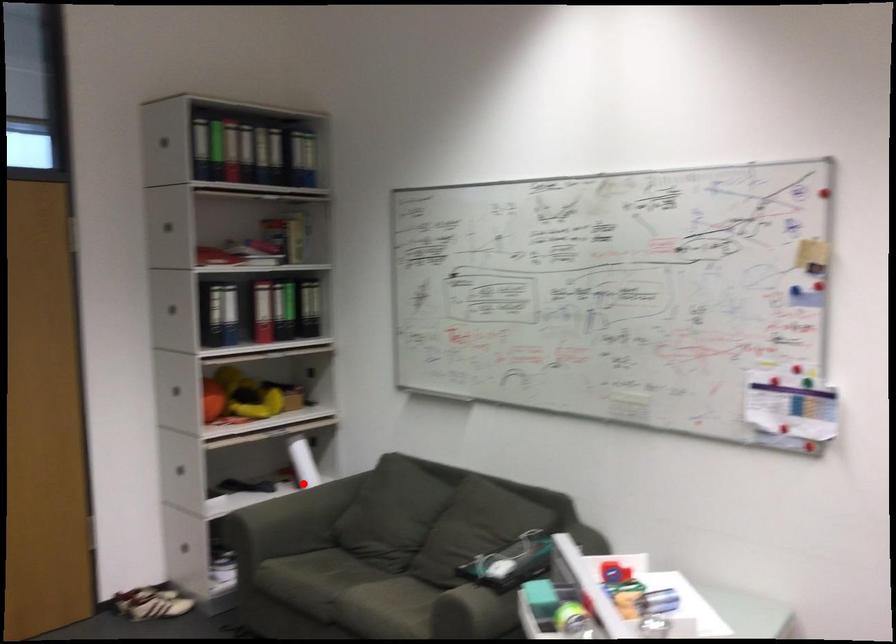
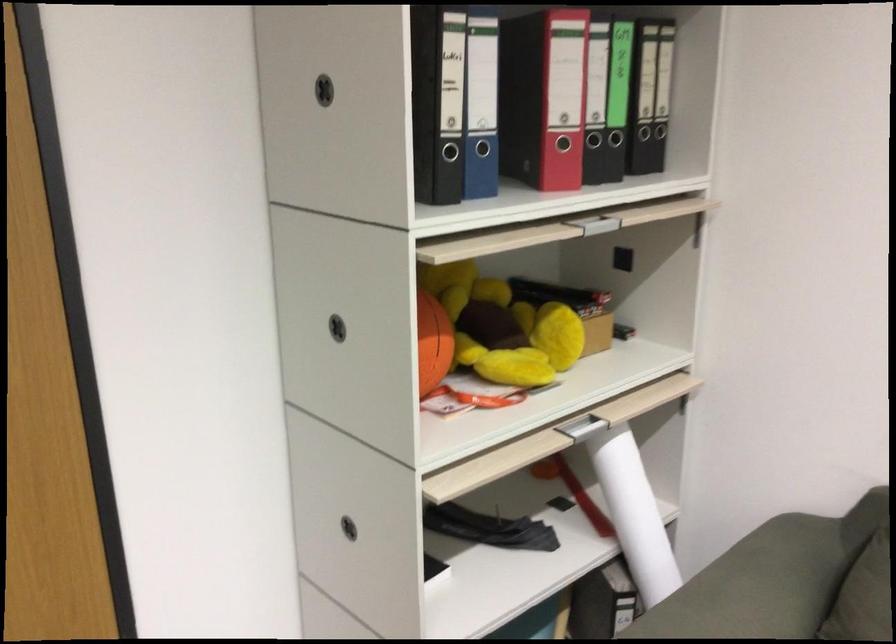
Question: I am providing you with two images of the same scene from different viewpoints. Given a red point in image1, look at the same physical point in image2. Is it:

Choices:
 (A) Closer to the viewpoint
 (B) Farther from the viewpoint

Answer: (A)